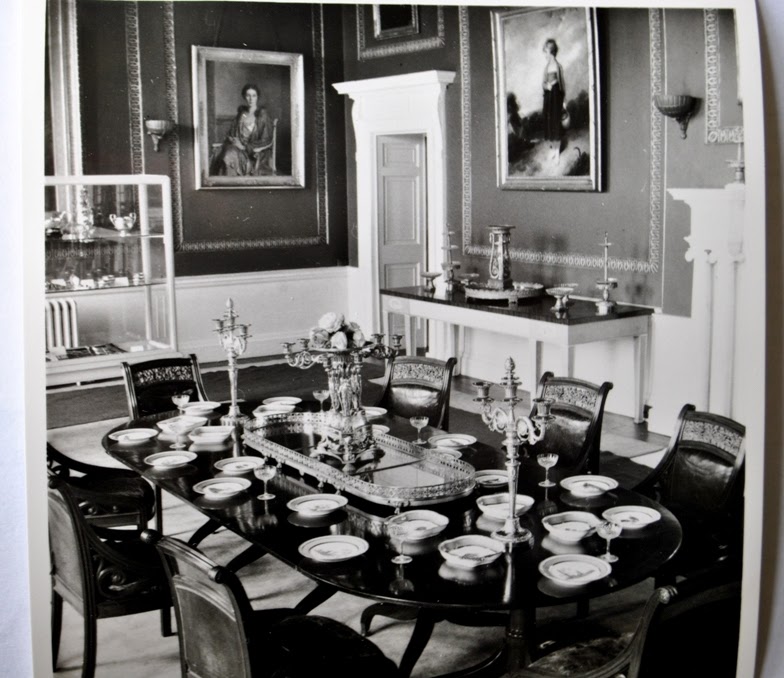
Where is `left of mantlepiece`? This screenshot has height=678, width=784. left of mantlepiece is located at coordinates (669, 281).